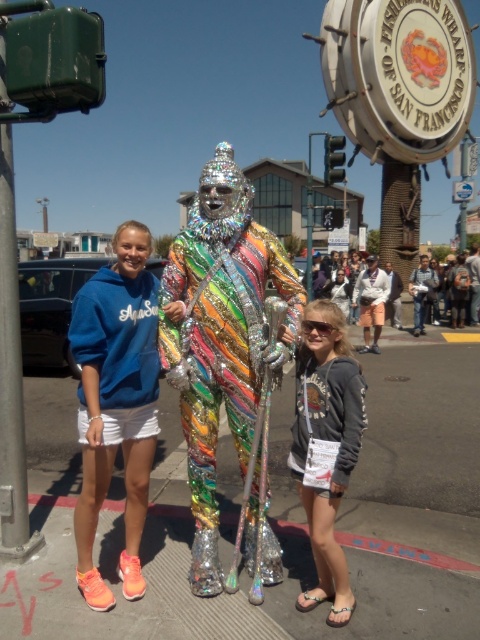
You are standing on the metallic reflective pavement at center and want to see the holographic metallic costume at center in the reflection. Is the costume visible in the pavement?

The metallic reflective pavement at center is below the holographic metallic costume at center, so the costume should be visible in the reflection since it is positioned above the reflective surface.

You are a photographer at Fisherman Wharfs and need to capture a clear shot of the person in the iridescent costume. However, two people are blocking the view. The blue cotton hoodie at center and the matte gray hoodie at center are in the way. Which one do you need to ask to move first to get a clear view of the iridescent costume?

The blue cotton hoodie at center is in front of the matte gray hoodie at center, so you should ask the person wearing the blue cotton hoodie at center to move first to clear the view.